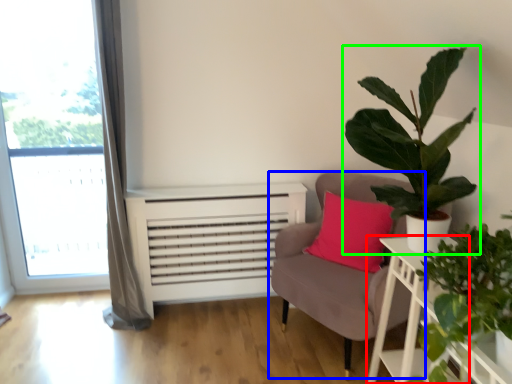
Question: Which is nearer to the table (highlighted by a red box)? chair (highlighted by a blue box) or houseplant (highlighted by a green box).

Choices:
 (A) chair
 (B) houseplant

Answer: (B)